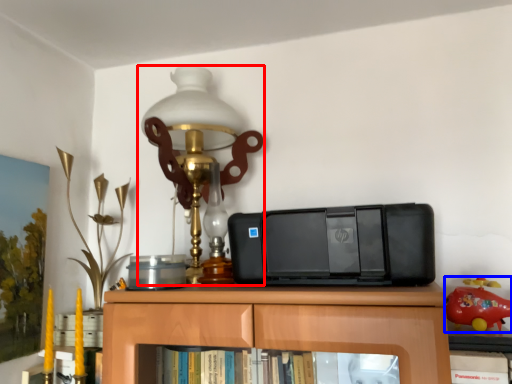
Question: Among these objects, which one is farthest to the camera, lamp (highlighted by a red box) or toy (highlighted by a blue box)?

Choices:
 (A) lamp
 (B) toy

Answer: (A)